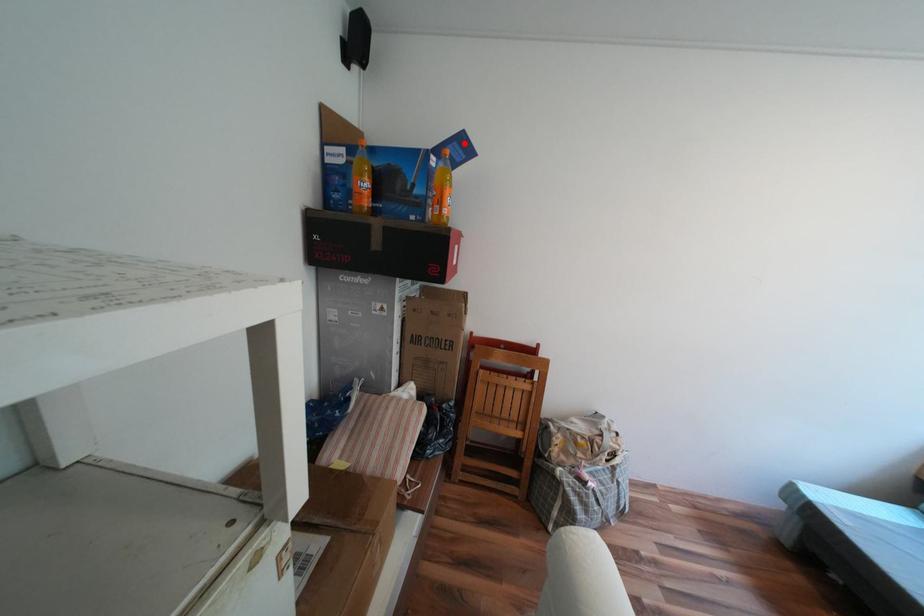
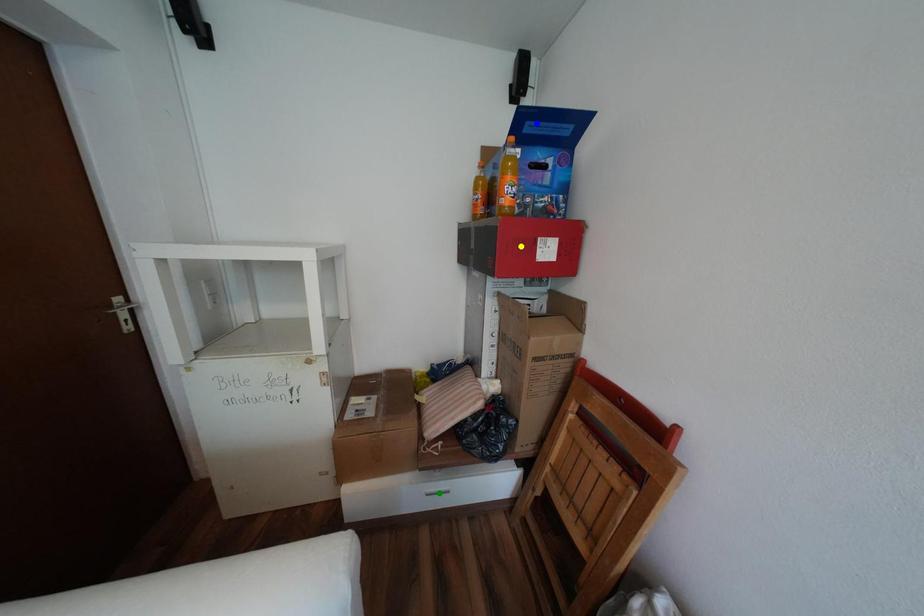
Question: I am providing you with two images of the same scene from different viewpoints. A red point is marked on the first image. You are given multiple points on the second image. In image 2, which mark is for the same physical point as the one in image 1?

Choices:
 (A) green point
 (B) yellow point
 (C) blue point

Answer: (C)